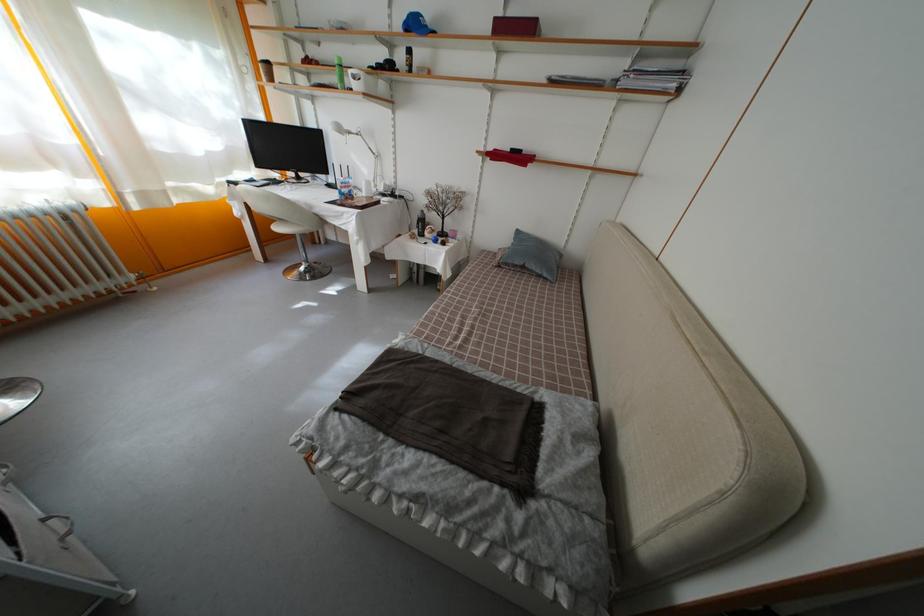
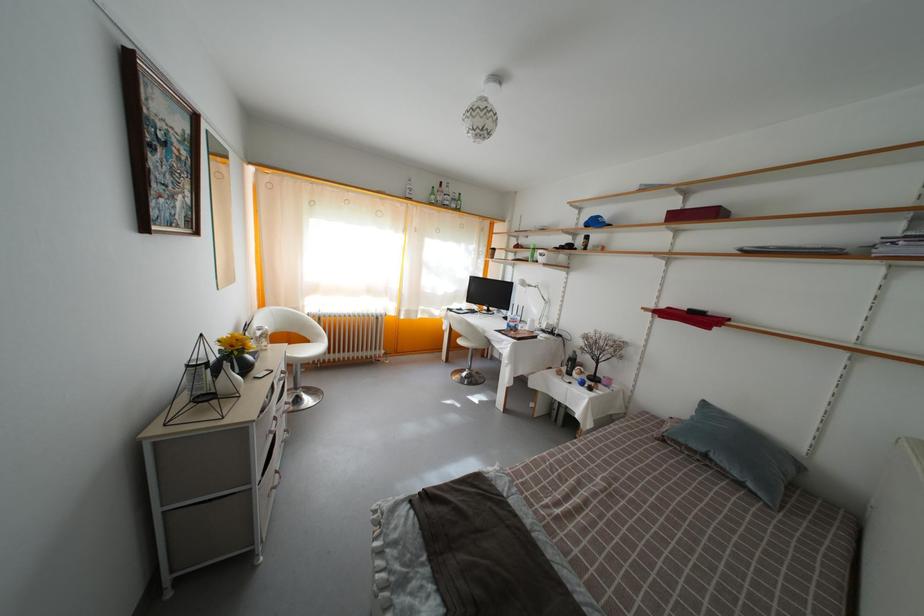
Where in the second image is the point corresponding to pixel 420 238 from the first image?

(569, 376)